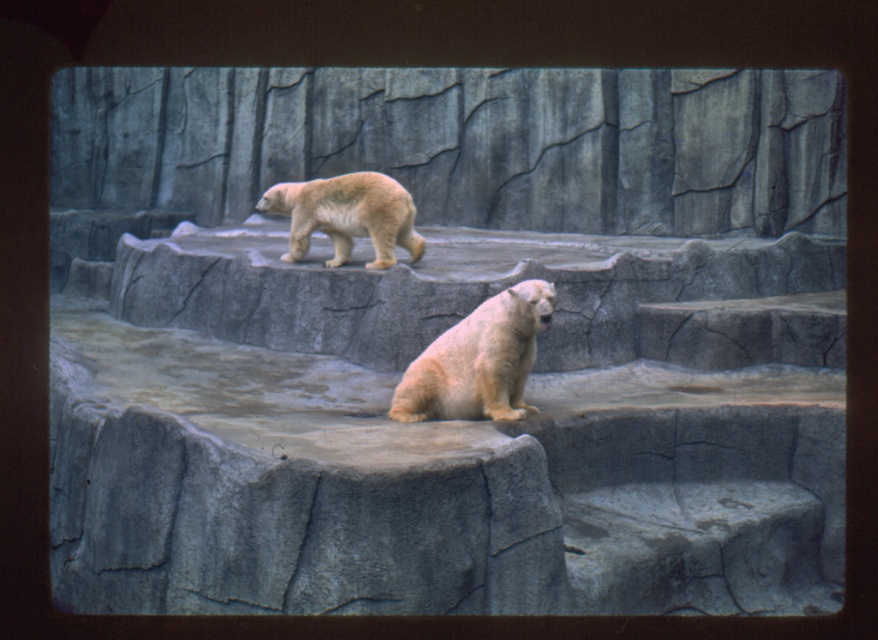
Question: Which point is farther to the camera?

Choices:
 (A) white fur bear at center
 (B) light beige fur at upper center

Answer: (B)

Question: Does white fur bear at center come in front of light beige fur at upper center?

Choices:
 (A) yes
 (B) no

Answer: (A)

Question: Which point is farther to the camera?

Choices:
 (A) (322, 227)
 (B) (434, 387)

Answer: (A)

Question: Is the position of white fur bear at center more distant than that of light beige fur at upper center?

Choices:
 (A) yes
 (B) no

Answer: (B)

Question: Considering the relative positions of white fur bear at center and light beige fur at upper center in the image provided, where is white fur bear at center located with respect to light beige fur at upper center?

Choices:
 (A) above
 (B) below

Answer: (B)